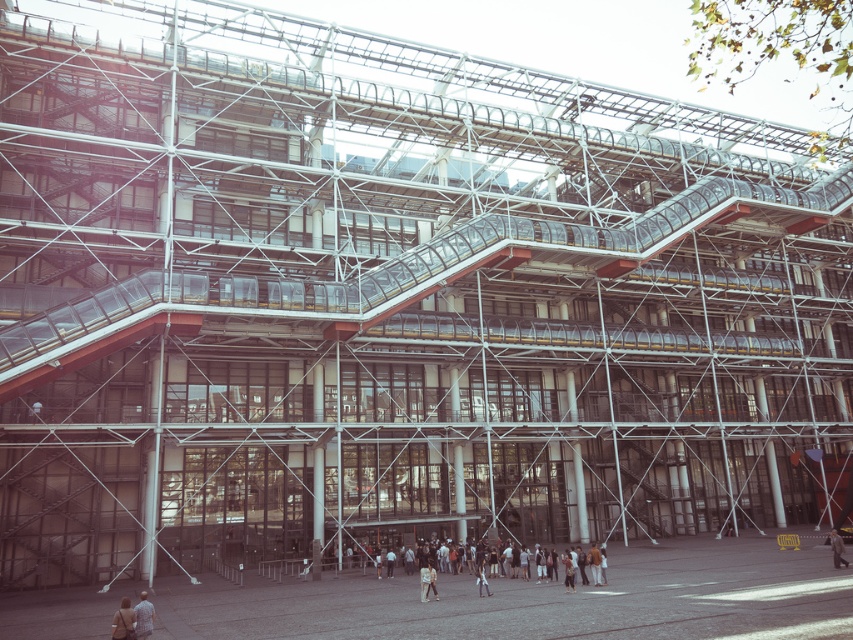
Is plaid fabric shirt at lower left positioned before light brown leather shoes at lower center?

Yes, it is.

Is plaid fabric shirt at lower left thinner than light brown leather shoes at lower center?

In fact, plaid fabric shirt at lower left might be wider than light brown leather shoes at lower center.

Identify the location of plaid fabric shirt at lower left. The height and width of the screenshot is (640, 853). (143, 616).

Is light brown leather jacket at lower left below light brown leather jacket at lower center?

No.

Does light brown leather jacket at lower left have a lesser height compared to light brown leather jacket at lower center?

Yes, light brown leather jacket at lower left is shorter than light brown leather jacket at lower center.

Is point (120, 605) positioned after point (421, 584)?

That is False.

This screenshot has height=640, width=853. Identify the location of light brown leather jacket at lower left. (123, 621).

Is point (508, 548) less distant than point (126, 636)?

That is False.

Is point (601, 563) positioned behind point (122, 621)?

Yes, point (601, 563) is behind point (122, 621).

Locate an element on the screen. Image resolution: width=853 pixels, height=640 pixels. light brown leather jacket at center is located at coordinates (508, 563).

Where is `light brown leather jacket at center`? Image resolution: width=853 pixels, height=640 pixels. light brown leather jacket at center is located at coordinates (508, 563).